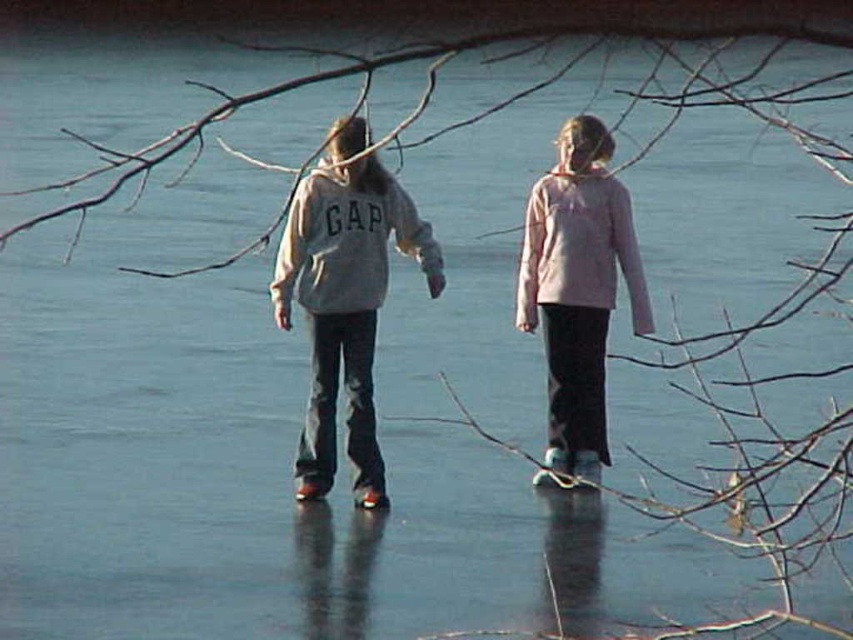
Is white cotton hoodie at center below gray cotton hoodie at center?

Indeed, white cotton hoodie at center is positioned under gray cotton hoodie at center.

This screenshot has width=853, height=640. I want to click on white cotton hoodie at center, so click(x=345, y=298).

Where is `white cotton hoodie at center`? The height and width of the screenshot is (640, 853). white cotton hoodie at center is located at coordinates (345, 298).

Who is more forward, [579,276] or [648,308]?

Point [579,276] is more forward.

How much distance is there between white cotton hoodie at center and pink fabric jacket at center?

37.48 inches

Is point (316, 211) less distant than point (552, 323)?

Yes, point (316, 211) is in front of point (552, 323).

I want to click on white cotton hoodie at center, so click(x=345, y=298).

Measure the distance between point (408, 230) and camera.

Point (408, 230) is 10.89 meters away from camera.

Can you confirm if gray cotton hoodie at center is wider than pink fabric jacket at center?

Indeed, gray cotton hoodie at center has a greater width compared to pink fabric jacket at center.

Which is in front, point (316, 422) or point (602, 180)?

Point (316, 422) is more forward.

This screenshot has height=640, width=853. What are the coordinates of `gray cotton hoodie at center` in the screenshot? It's located at (345, 300).